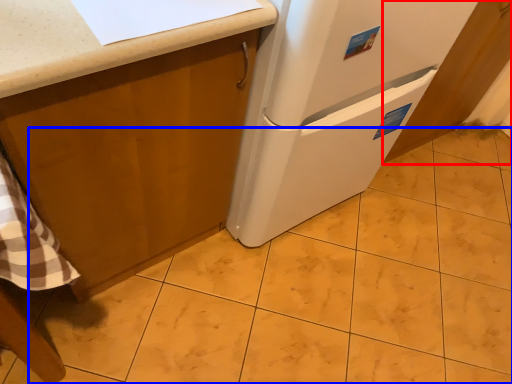
Question: Which point is closer to the camera, cabinetry (highlighted by a red box) or tile (highlighted by a blue box)?

Choices:
 (A) cabinetry
 (B) tile

Answer: (B)